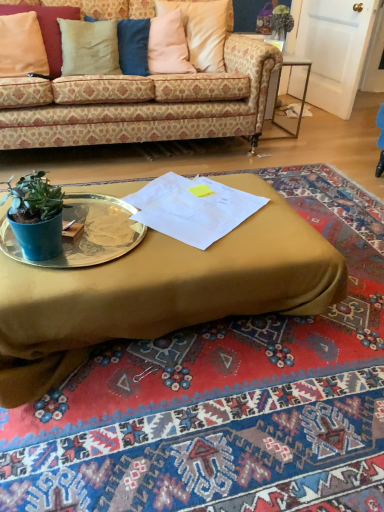
Question: Can you confirm if metallic silver platter at center is positioned to the right of patterned fabric couch at upper center?

Choices:
 (A) yes
 (B) no

Answer: (A)

Question: From a real-world perspective, is metallic silver platter at center physically below patterned fabric couch at upper center?

Choices:
 (A) no
 (B) yes

Answer: (B)

Question: Is metallic silver platter at center far from patterned fabric couch at upper center?

Choices:
 (A) yes
 (B) no

Answer: (A)

Question: Is metallic silver platter at center in contact with patterned fabric couch at upper center?

Choices:
 (A) yes
 (B) no

Answer: (B)

Question: Is metallic silver platter at center positioned in front of patterned fabric couch at upper center?

Choices:
 (A) yes
 (B) no

Answer: (A)

Question: Choose the correct answer: Is patterned fabric couch at upper center inside pink fabric pillow at upper center, positioned as the first pillow in right-to-left order, or outside it?

Choices:
 (A) outside
 (B) inside

Answer: (A)

Question: In terms of width, does patterned fabric couch at upper center look wider or thinner when compared to pink fabric pillow at upper center, which is the 3th pillow from left to right?

Choices:
 (A) thin
 (B) wide

Answer: (B)

Question: Based on their sizes in the image, would you say patterned fabric couch at upper center is bigger or smaller than pink fabric pillow at upper center, which is the 3th pillow from left to right?

Choices:
 (A) small
 (B) big

Answer: (B)

Question: Is patterned fabric couch at upper center taller or shorter than pink fabric pillow at upper center, positioned as the first pillow in right-to-left order?

Choices:
 (A) short
 (B) tall

Answer: (B)

Question: From a real-world perspective, is beige fabric pillow at upper left, acting as the second pillow starting from the left, physically located above or below patterned fabric couch at upper center?

Choices:
 (A) below
 (B) above

Answer: (B)

Question: Is beige fabric pillow at upper left, which is the second pillow from right to left, wider or thinner than patterned fabric couch at upper center?

Choices:
 (A) wide
 (B) thin

Answer: (B)

Question: Considering the positions of beige fabric pillow at upper left, which is the second pillow from right to left, and patterned fabric couch at upper center in the image, is beige fabric pillow at upper left, which is the second pillow from right to left, taller or shorter than patterned fabric couch at upper center?

Choices:
 (A) tall
 (B) short

Answer: (B)

Question: Considering the positions of point (100, 53) and point (173, 117), is point (100, 53) closer or farther from the camera than point (173, 117)?

Choices:
 (A) farther
 (B) closer

Answer: (A)

Question: In the image, is pink fabric pillow at upper center, which is the 3th pillow from left to right, positioned in front of or behind metallic mirrored side table at right?

Choices:
 (A) front
 (B) behind

Answer: (A)

Question: Does point (193, 20) appear closer or farther from the camera than point (304, 57)?

Choices:
 (A) closer
 (B) farther

Answer: (A)